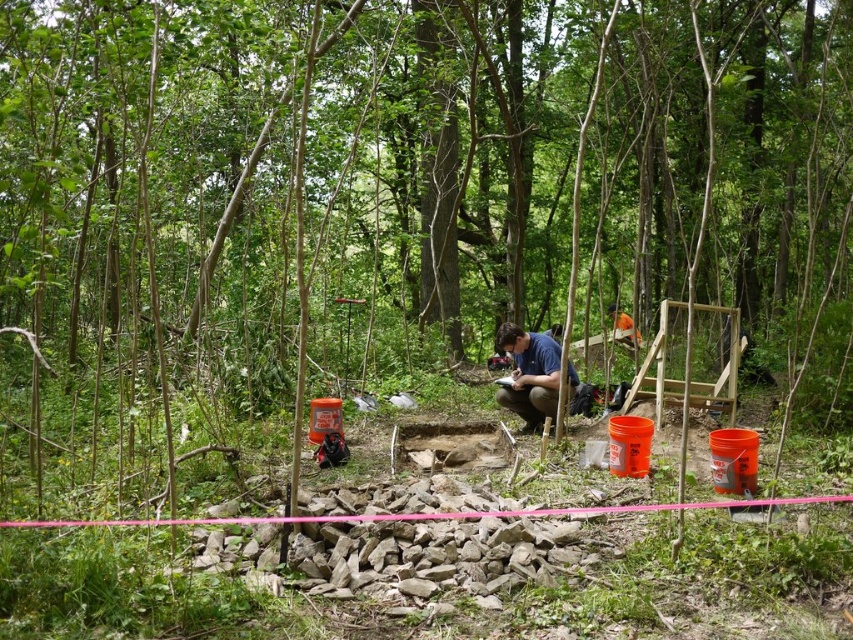
Question: Is blue fabric squat at center smaller than orange hard hat at center?

Choices:
 (A) yes
 (B) no

Answer: (A)

Question: Does blue fabric squat at center appear on the left side of orange hard hat at center?

Choices:
 (A) yes
 (B) no

Answer: (A)

Question: Is blue fabric squat at center above orange hard hat at center?

Choices:
 (A) yes
 (B) no

Answer: (B)